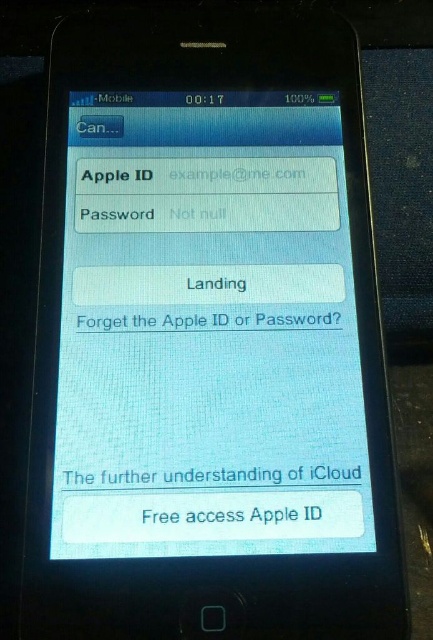
You are holding a smartphone with a screen that has two texts displayed. The first text is labeled as white matte text at bottom and the second is white paper text at center. If you want to touch both texts with your finger, which one do you need to reach first?

You need to reach the white paper text at center first because it is closer to you than the white matte text at bottom.

You are holding an iPhone 4 and looking at its screen. You notice the white glossy screen at center and the white matte text at bottom. Which object is closer to your eyes?

The white glossy screen at center is closer to your eyes because it is positioned over the white matte text at bottom, meaning it is layered in front of it.